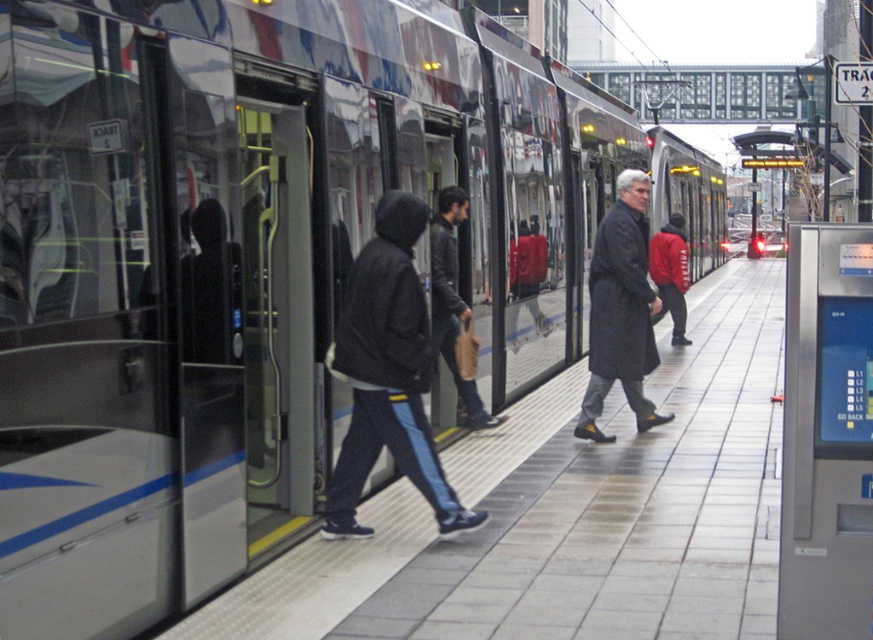
Question: Is the position of leather jacket at center less distant than that of red fleece jacket at center?

Choices:
 (A) yes
 (B) no

Answer: (A)

Question: Can you confirm if dark blue jeans at center is thinner than dark gray coat at center?

Choices:
 (A) yes
 (B) no

Answer: (A)

Question: Which of the following is the closest to the observer?

Choices:
 (A) dark blue jeans at center
 (B) red fleece jacket at center
 (C) dark gray coat at center

Answer: (A)

Question: Which point is farther from the camera taking this photo?

Choices:
 (A) (668, 252)
 (B) (455, 260)

Answer: (A)

Question: Considering the real-world distances, which object is farthest from the dark blue jeans at center?

Choices:
 (A) red fleece jacket at center
 (B) leather jacket at center
 (C) dark gray coat at center

Answer: (A)

Question: Does dark blue jeans at center appear on the right side of leather jacket at center?

Choices:
 (A) yes
 (B) no

Answer: (B)